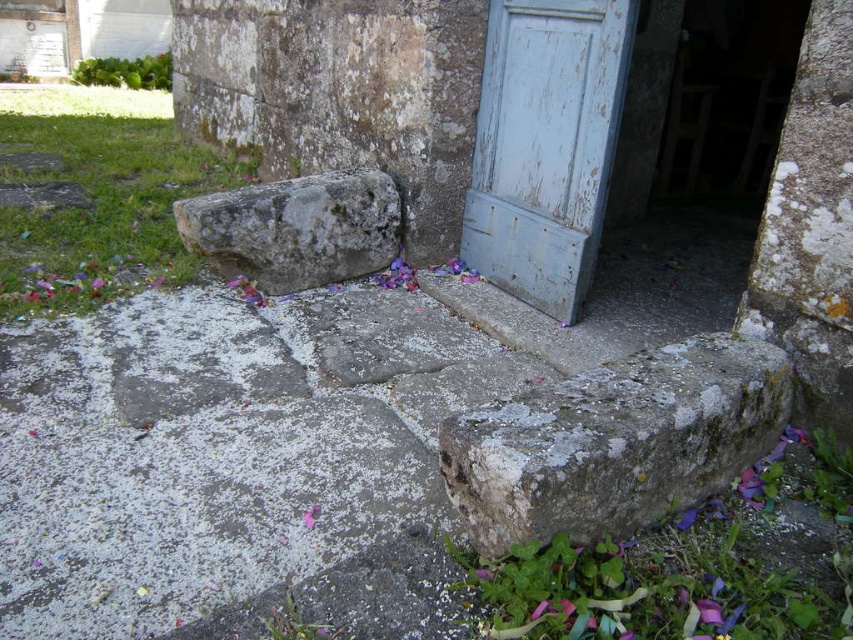
Question: Is blue weathered wood door at center right closer to camera compared to gray rough stone at center?

Choices:
 (A) yes
 (B) no

Answer: (A)

Question: Is gray rough stone at center closer to the viewer compared to pink paper flower at center?

Choices:
 (A) yes
 (B) no

Answer: (B)

Question: From the image, what is the correct spatial relationship of blue weathered wood door at center right in relation to gray rough stone at center?

Choices:
 (A) below
 (B) above

Answer: (B)

Question: Which object is farther from the camera taking this photo?

Choices:
 (A) pink paper flower at center
 (B) gray rough stone at center

Answer: (B)

Question: Which is nearer to the pink paper flower at center?

Choices:
 (A) blue weathered wood door at center right
 (B) gray rough stone at center
 (C) lichen-covered stone at lower right

Answer: (C)

Question: Which object is farther from the camera taking this photo?

Choices:
 (A) lichen-covered stone at lower right
 (B) blue weathered wood door at center right

Answer: (B)